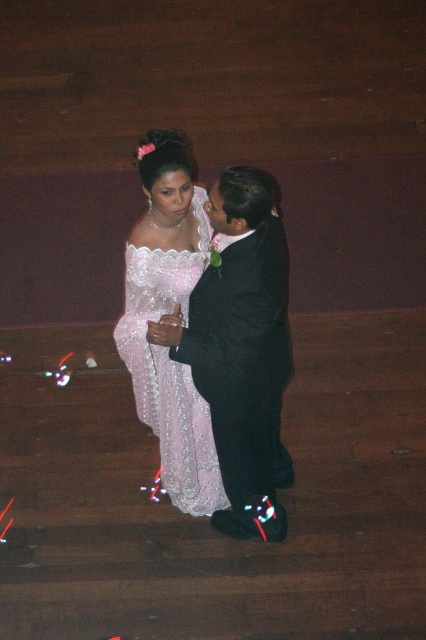
You are a photographer at a formal event. You want to capture a closeup shot of both the shiny black suit at center and the matte lace dress at center in the same frame. The camera has a minimum focusing distance of 25 centimeters. Will you be able to achieve this shot without moving the subjects?

The shiny black suit at center is 25.22 centimeters away from the matte lace dress at center. Since the minimum focusing distance is 25 centimeters, the photographer can capture both subjects in the same frame without moving them because the distance between them is just over the required minimum.

You are a photographer at a formal event and need to position a spotlight on the shiny black suit at center and the matte lace dress at center. Which object should you aim the spotlight towards if you want it to hit the one on the left side?

The matte lace dress at center is on the left side, so you should aim the spotlight towards the matte lace dress at center.

You are a photographer at a formal event. You need to position a spotlight exactly at the center of the shiny black suit at center to highlight it. What are the coordinates where you should place the spotlight?

The coordinates for the shiny black suit at center are at point [241,349], so you should place the spotlight there.